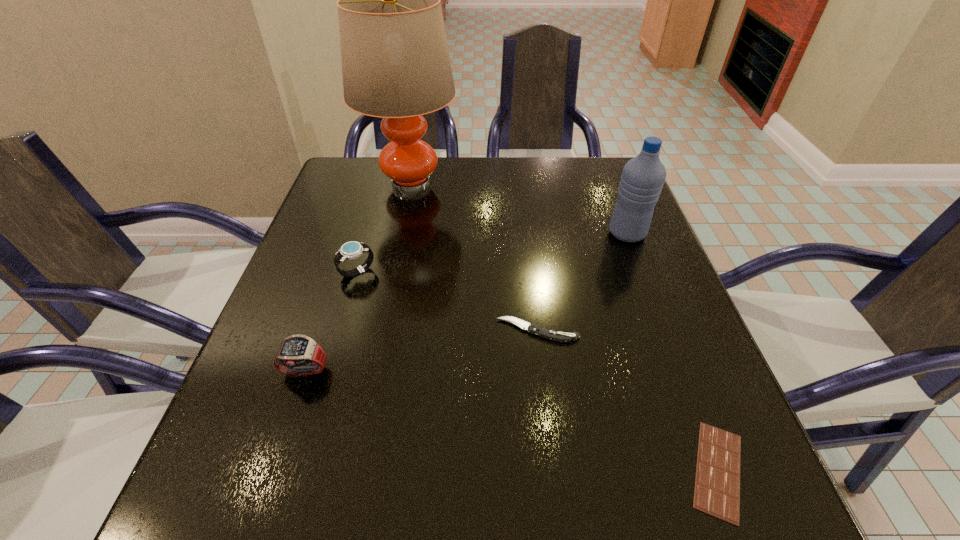
Choose which object is the second nearest neighbor to the shortest object. Please provide its 2D coordinates. Your answer should be formatted as a tuple, i.e. [(x, y)], where the tuple contains the x and y coordinates of a point satisfying the conditions above.

[(642, 179)]

Find the location of a particular element. The height and width of the screenshot is (540, 960). free space that satisfies the following two spatial constraints: 1. on the front side of the nearest object; 2. on the right side of the pocketknife is located at coordinates (554, 470).

Locate an element on the screen. vacant area in the image that satisfies the following two spatial constraints: 1. on the back side of the second farthest object; 2. on the right side of the farther watch is located at coordinates (369, 233).

Where is `vacant space that satisfies the following two spatial constraints: 1. on the back side of the nearer watch; 2. on the left side of the fifth shortest object`? This screenshot has height=540, width=960. vacant space that satisfies the following two spatial constraints: 1. on the back side of the nearer watch; 2. on the left side of the fifth shortest object is located at coordinates (351, 233).